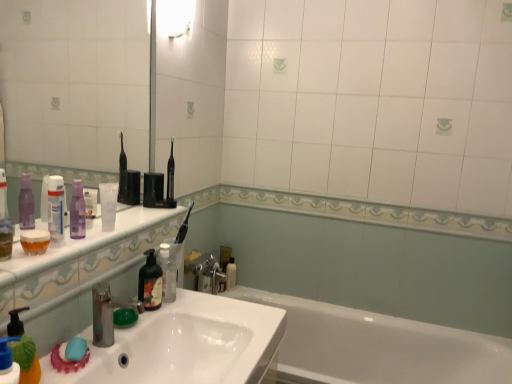
Find the location of a particular element. The width and height of the screenshot is (512, 384). vacant area that is situated to the right of white glossy bottle at lower center, the fourth toiletry from the top is located at coordinates (252, 292).